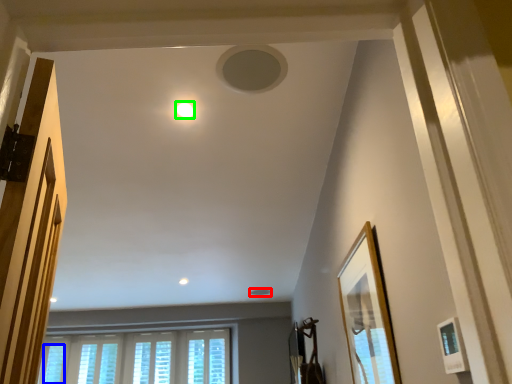
Question: Which is nearer to the hole (highlighted by a red box)? window (highlighted by a blue box) or lighting (highlighted by a green box).

Choices:
 (A) window
 (B) lighting

Answer: (A)